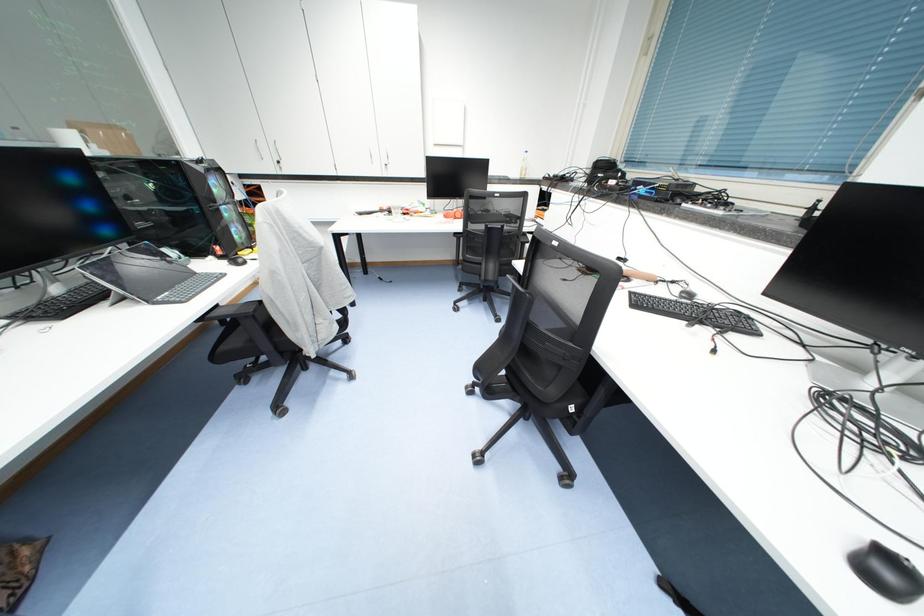
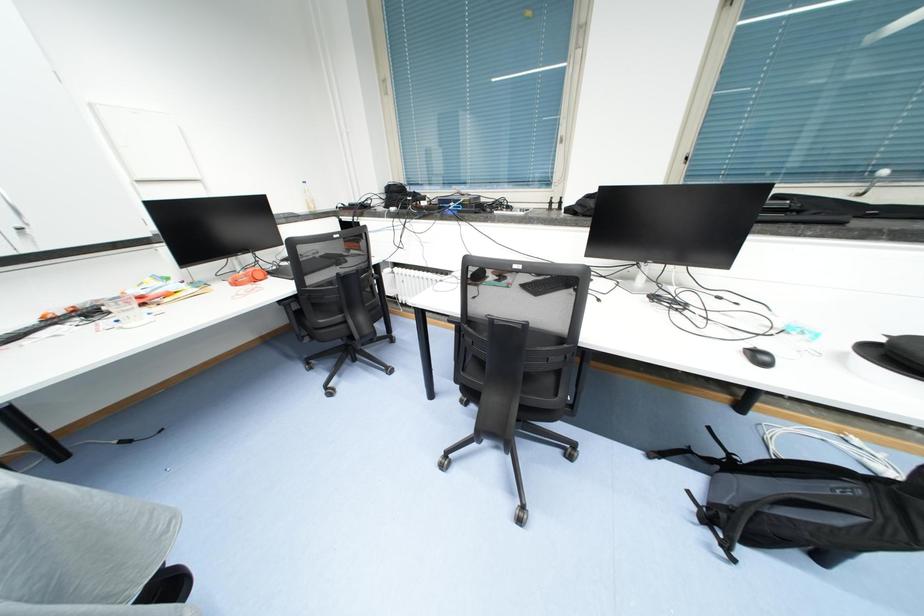
Question: The camera is either moving clockwise (left) or counter-clockwise (right) around the object. The first image is from the beginning of the video and the second image is from the end. Is the camera moving left or right when shooting the video?

Choices:
 (A) Left
 (B) Right

Answer: (A)